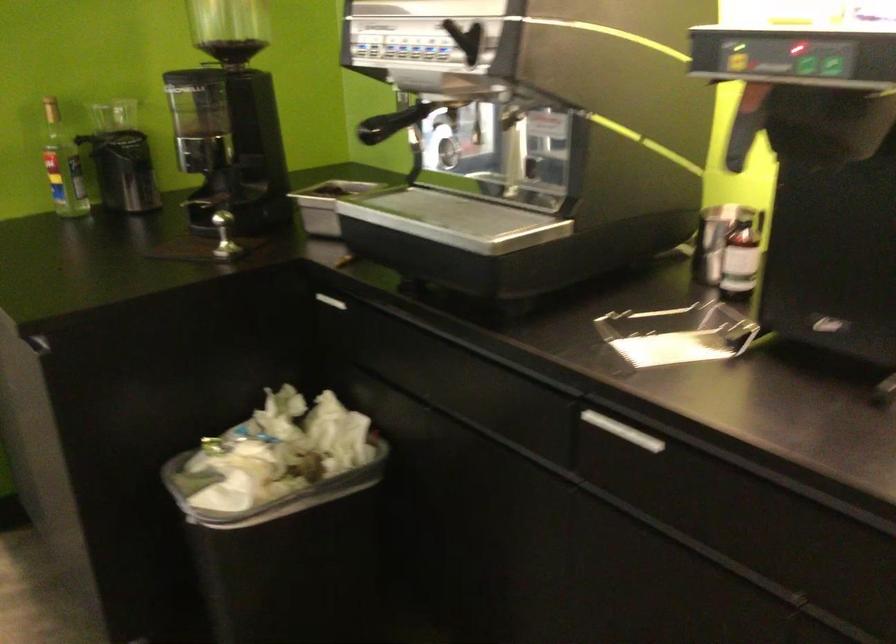
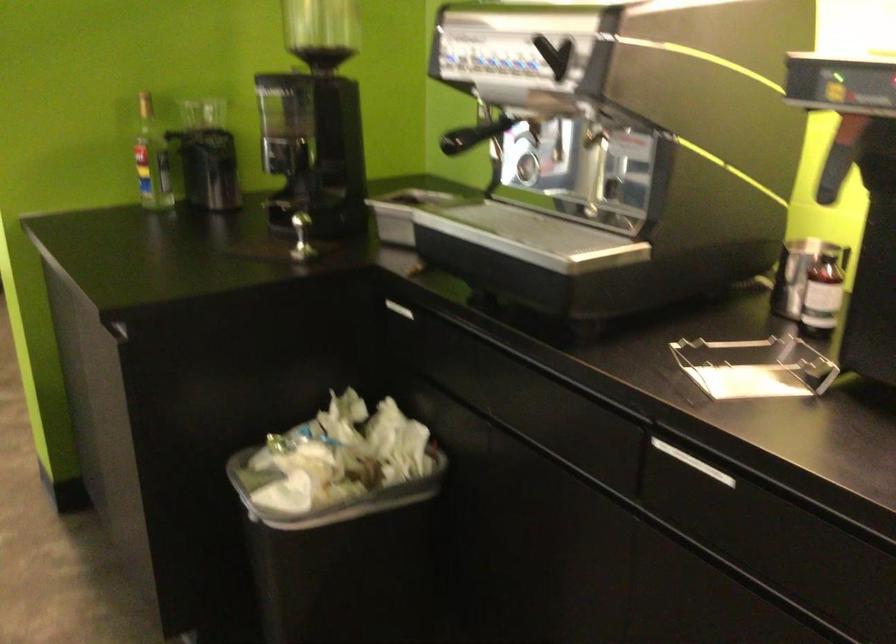
Question: In a continuous first-person perspective shot, in which direction is the camera moving?

Choices:
 (A) Left
 (B) Right
 (C) Forward
 (D) Backward

Answer: (A)